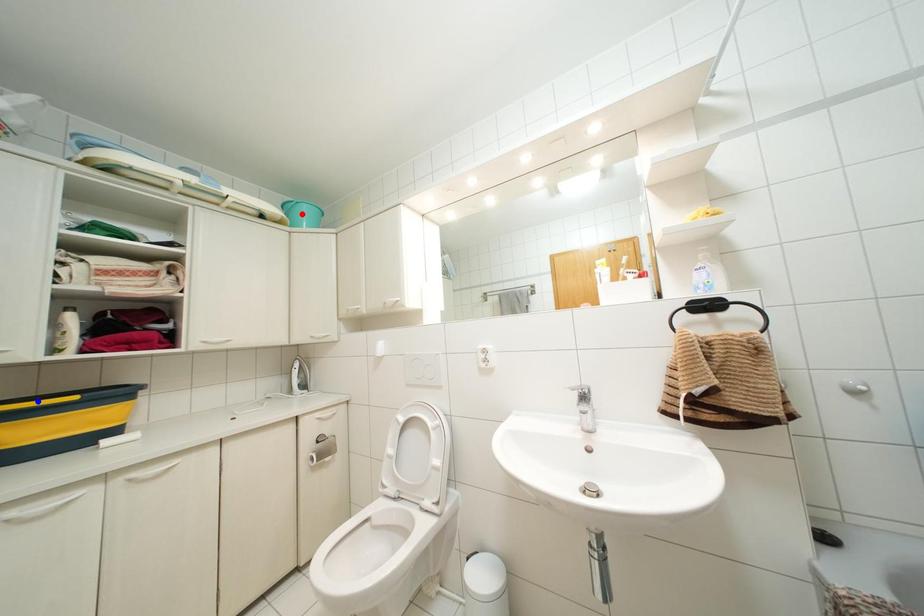
Question: Two points are marked on the image. Which point is closer to the camera?

Choices:
 (A) Blue point is closer.
 (B) Red point is closer.

Answer: (A)